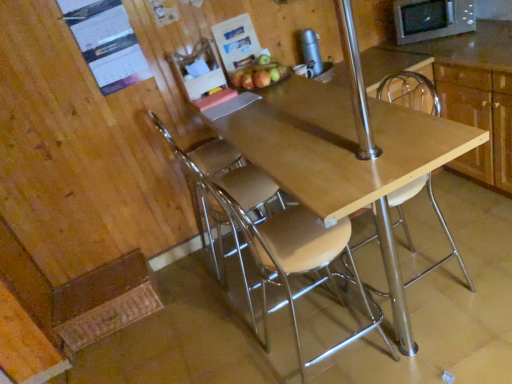
You are a GUI agent. You are given a task and a screenshot of the screen. Output one action in this format:
    pyautogui.click(x=<x>, y=<y>)
    Task: Click on the free space to the left of wooden seat at center, which is the 2th chair from left to right
    This screenshot has width=512, height=384.
    Given the screenshot: What is the action you would take?
    pyautogui.click(x=242, y=355)